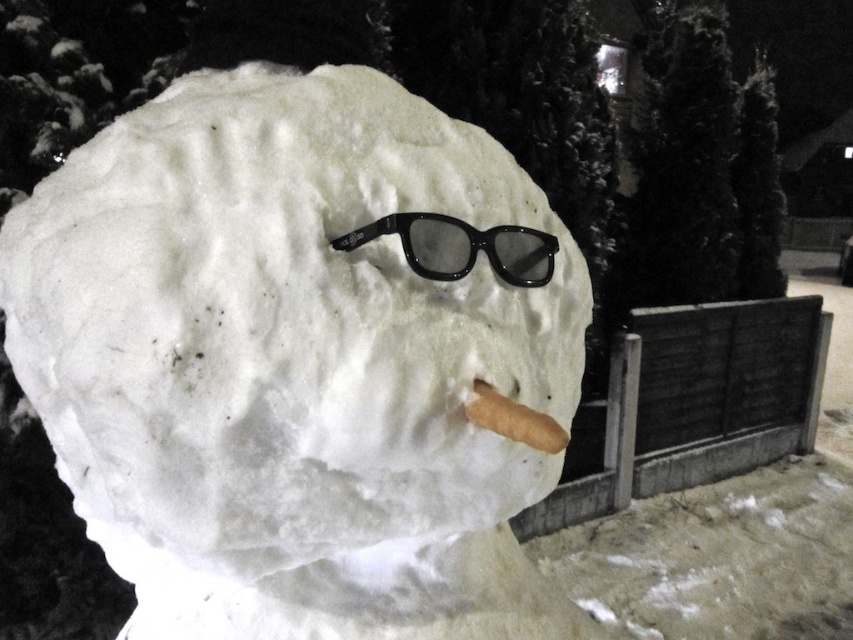
You are standing in front of the snowman and want to place a decoration on the point that is closer to you. Which point should you choose between point (198, 141) and point (453, 236)?

You should choose point (198, 141) because it is closer to you than point (453, 236).

You are a child trying to decide whether to place a small hat on the white fluffy snowman at center or the black plastic goggles at center. Which object can the hat fit on better based on their sizes?

The white fluffy snowman at center is larger in size than the black plastic goggles at center, so the hat would fit better on the white fluffy snowman at center.

You are standing at the point with coordinates [293,362] in the image. What object is located exactly at this point?

The white fluffy snowman at center is located exactly at the point with coordinates [293,362].